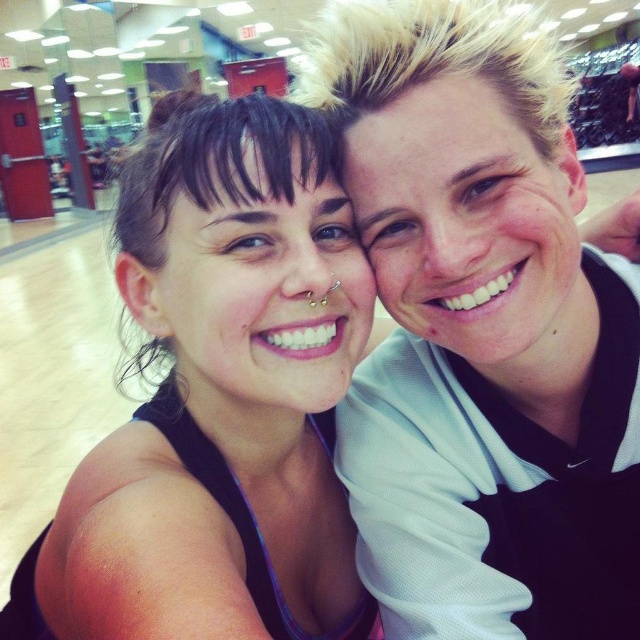
You are a photographer setting up a shoot in a gym. You need to place a small prop at the exact coordinates of point (481, 332). What object is located at that point?

The point (481, 332) marks the location of the black mesh shirt at upper right.

From the picture: You are standing in the gym and want to move from the point at coordinates point (x=550, y=198) to the point at coordinates point (x=152, y=164). Can you walk directly between them without any obstacles?

Point (x=550, y=198) is in front of point (x=152, y=164), so there is no obstacle between them. You can walk directly between them.

You are a photographer standing 10 feet away from the black mesh shirt at upper right. You want to take a closeup shot of it. Do you think you can move closer to it without exceeding the 10 feet distance?

The black mesh shirt at upper right is 29.01 inches away from the photographer, so yes, you can move closer to it without exceeding the 10 feet distance since 29.01 inches is less than 10 feet.